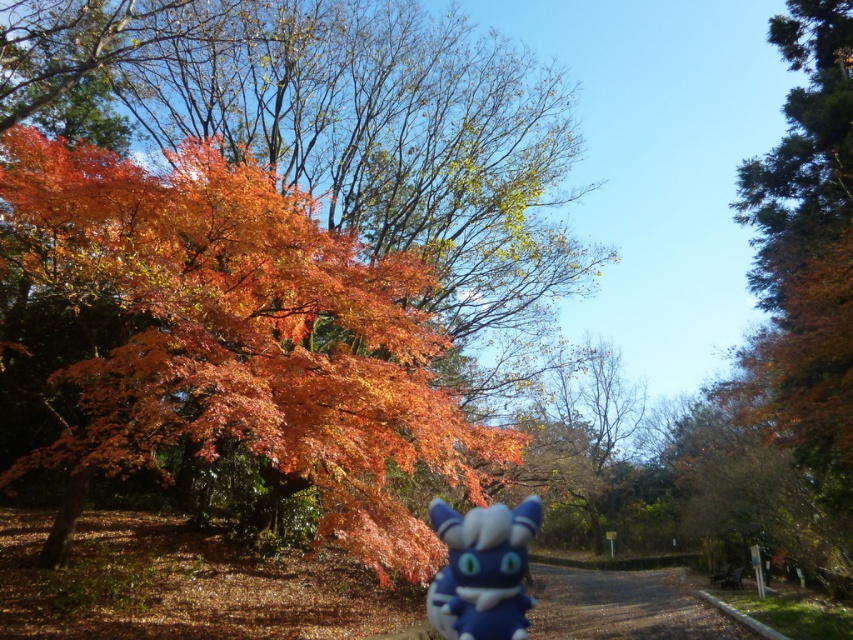
Question: Which point appears farthest from the camera in this image?

Choices:
 (A) (503, 609)
 (B) (360, 424)

Answer: (B)

Question: Is shiny orange leaves at left closer to camera compared to blue plush toy at center?

Choices:
 (A) yes
 (B) no

Answer: (B)

Question: Can you confirm if shiny orange leaves at left is thinner than blue plush toy at center?

Choices:
 (A) yes
 (B) no

Answer: (A)

Question: Which point is farther from the camera taking this photo?

Choices:
 (A) (486, 524)
 (B) (222, 413)

Answer: (B)

Question: Is shiny orange leaves at left positioned behind blue plush toy at center?

Choices:
 (A) yes
 (B) no

Answer: (A)